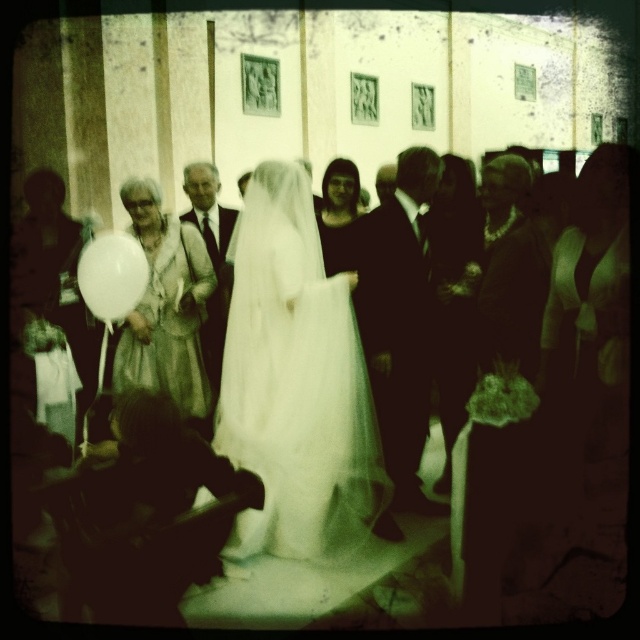
You are a photographer analyzing the composition of this vintage wedding image. The bride in the white satin dress at center is standing in front of the guests. Based on the coordinates provided, is the dress positioned closer to the bottom or the top of the image?

The white satin dress at center is located at point coordinates with a y value of 0.920, which places it closer to the bottom of the image since lower y values correspond to positions closer to the bottom in standard coordinate systems.

What object is located at the coordinate point (588,388) in the wedding scene?

The white satin dress at center is located at the coordinate point (588,388).

You are a photographer at the wedding and you need to adjust the lighting for the bride. The matte black suit at right and the shiny black suit at center are both in the frame. Which suit should you focus on to ensure proper exposure since black clothing can be tricky in lighting?

The matte black suit at right has a larger size compared to shiny black suit at center, so focusing on the larger matte black suit at right would help ensure proper exposure as it occupies more space in the frame and its matte finish might require different lighting adjustments.